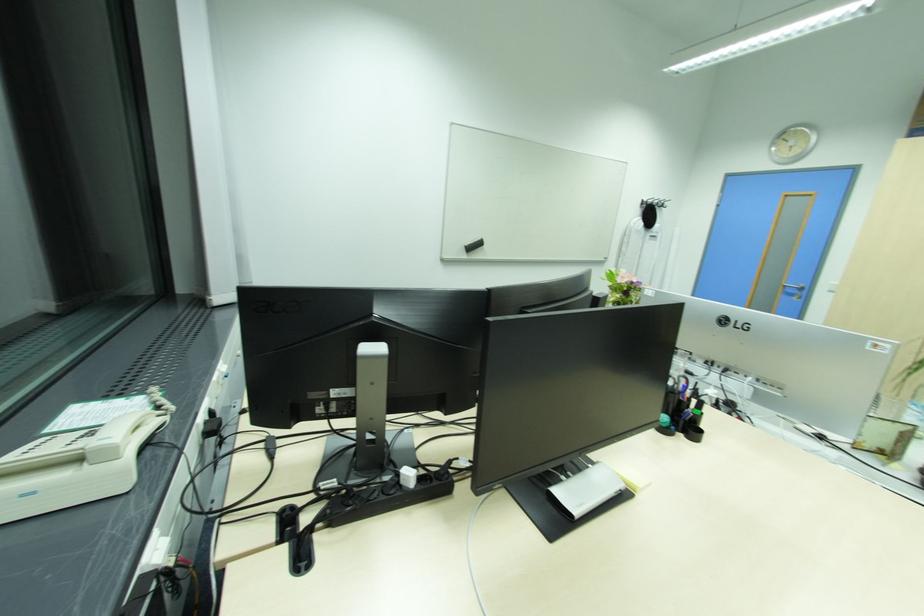
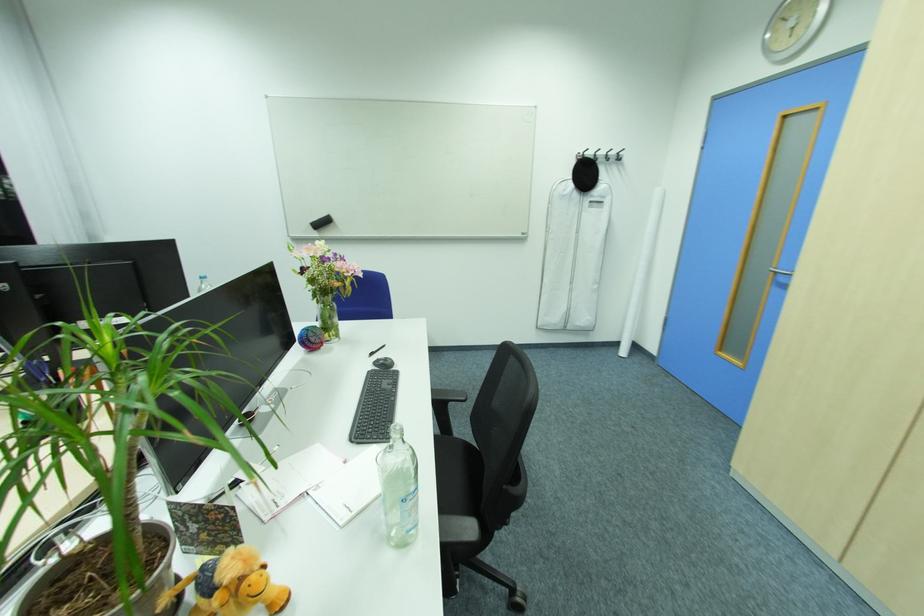
Question: The images are taken continuously from a first-person perspective. In which direction are you moving?

Choices:
 (A) Left
 (B) Right
 (C) Forward
 (D) Backward

Answer: (B)